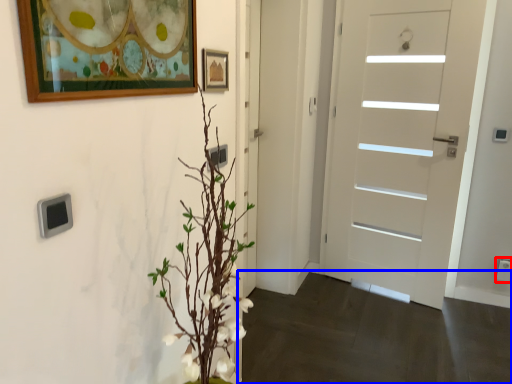
Question: Which object appears farthest to the camera in this image, electric outlet (highlighted by a red box) or corridor (highlighted by a blue box)?

Choices:
 (A) electric outlet
 (B) corridor

Answer: (A)